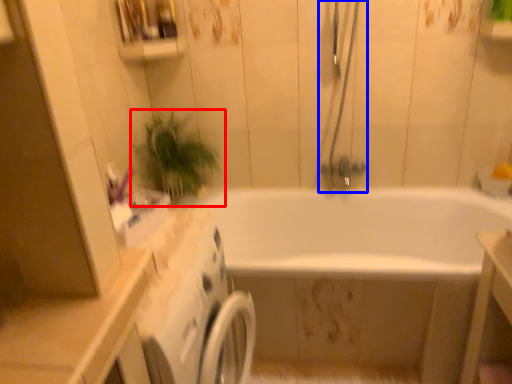
Question: Which of the following is the closest to the observer, houseplant (highlighted by a red box) or shower door (highlighted by a blue box)?

Choices:
 (A) houseplant
 (B) shower door

Answer: (B)